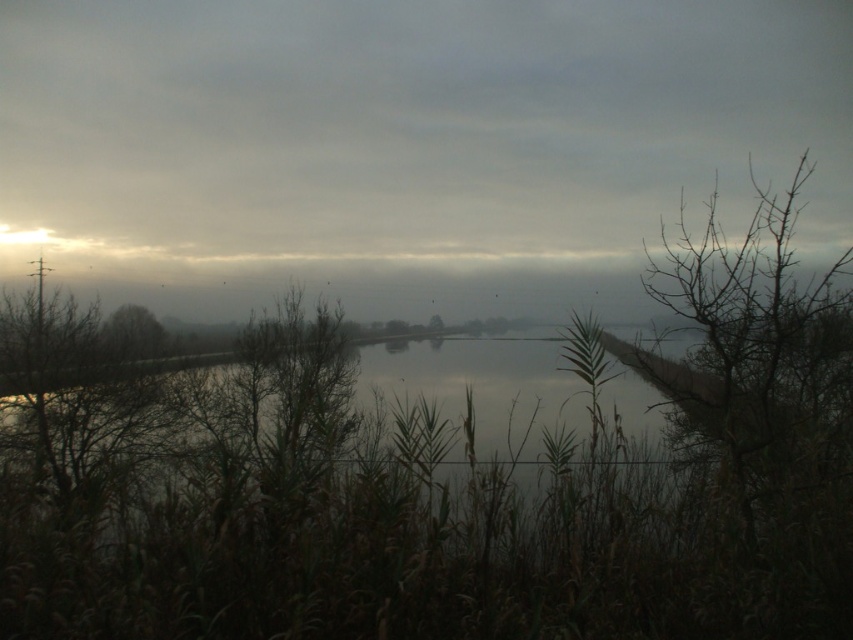
Question: Does bare branches at right have a smaller size compared to brown leafless tree at left?

Choices:
 (A) yes
 (B) no

Answer: (A)

Question: Can you confirm if bare branches at right is positioned to the left of brown leafless tree at left?

Choices:
 (A) yes
 (B) no

Answer: (B)

Question: Among these objects, which one is farthest from the camera?

Choices:
 (A) brown leafless tree at left
 (B) green leafy tree at center
 (C) bare branches at right

Answer: (A)

Question: Estimate the real-world distances between objects in this image. Which object is closer to the bare branches at right?

Choices:
 (A) brown leafless tree at left
 (B) green leafy tree at center

Answer: (B)

Question: Based on their relative distances, which object is farther from the brown leafless tree at left?

Choices:
 (A) bare branches at right
 (B) green leafy tree at center

Answer: (A)

Question: Can you confirm if bare branches at right is positioned to the right of brown leafless tree at left?

Choices:
 (A) no
 (B) yes

Answer: (B)